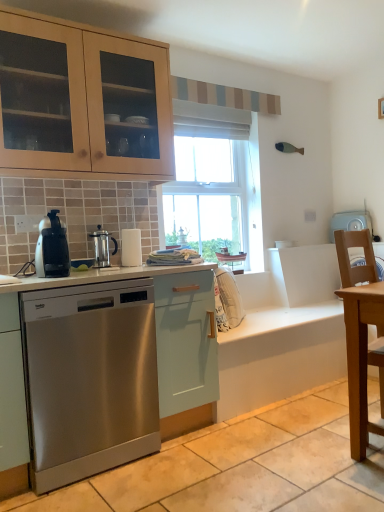
What do you see at coordinates (102, 247) in the screenshot? I see `satin silver coffee press at center` at bounding box center [102, 247].

Where is `light brown wooden table at right`? The height and width of the screenshot is (512, 384). light brown wooden table at right is located at coordinates (360, 358).

The height and width of the screenshot is (512, 384). Find the location of `satin silver coffee press at center`. satin silver coffee press at center is located at coordinates (102, 247).

Is stainless steel dishwasher at left spatially inside satin black coffee maker at left, or outside of it?

stainless steel dishwasher at left cannot be found inside satin black coffee maker at left.

Is stainless steel dishwasher at left wider or thinner than satin black coffee maker at left?

stainless steel dishwasher at left is wider than satin black coffee maker at left.

Is point (7, 296) farther from camera compared to point (55, 231)?

No, it is in front of (55, 231).

From the image's perspective, is stainless steel dishwasher at left below satin black coffee maker at left?

Correct, stainless steel dishwasher at left appears lower than satin black coffee maker at left in the image.

From the image's perspective, between satin black coffee maker at left and light blue plastic washing machine at right, who is located below?

satin black coffee maker at left is shown below in the image.

Would you say satin black coffee maker at left is inside or outside light blue plastic washing machine at right?

satin black coffee maker at left is located beyond the bounds of light blue plastic washing machine at right.

In the image, there is a light blue plastic washing machine at right. Identify the location of home appliance below it (from the image's perspective). The width and height of the screenshot is (384, 512). (52, 248).

Which of these two, satin black coffee maker at left or light blue plastic washing machine at right, stands taller?

Standing taller between the two is light blue plastic washing machine at right.

This screenshot has height=512, width=384. I want to click on home appliance in front of the satin silver coffee press at center, so click(52, 248).

Does satin silver coffee press at center have a larger size compared to satin black coffee maker at left?

No, satin silver coffee press at center is not bigger than satin black coffee maker at left.

Is satin silver coffee press at center positioned far away from satin black coffee maker at left?

No, satin silver coffee press at center is in close proximity to satin black coffee maker at left.

Does stainless steel dishwasher at left have a lesser width compared to satin silver coffee press at center?

No.

Is stainless steel dishwasher at left to the left or to the right of satin silver coffee press at center in the image?

Clearly, stainless steel dishwasher at left is on the left of satin silver coffee press at center in the image.

Find the location of `kitchen appliance that is above the stainless steel dishwasher at left (from a real-world perspective)`. kitchen appliance that is above the stainless steel dishwasher at left (from a real-world perspective) is located at coordinates (102, 247).

From the image's perspective, is stainless steel dishwasher at left located beneath satin silver coffee press at center?

Indeed, from the image's perspective, stainless steel dishwasher at left is shown beneath satin silver coffee press at center.

In terms of height, does light blue plastic washing machine at right look taller or shorter compared to stainless steel dishwasher at left?

Clearly, light blue plastic washing machine at right is shorter compared to stainless steel dishwasher at left.

Is point (353, 218) closer or farther from the camera than point (137, 268)?

Point (353, 218) is farther from the camera than point (137, 268).

Relative to stainless steel dishwasher at left, is light blue plastic washing machine at right in front or behind?

In the image, light blue plastic washing machine at right appears behind stainless steel dishwasher at left.

Is stainless steel dishwasher at left inside light blue plastic washing machine at right?

No.

Consider the image. What's the angular difference between light blue plastic washing machine at right and satin black coffee maker at left's facing directions?

There is a 88.8-degree angle between the facing directions of light blue plastic washing machine at right and satin black coffee maker at left.

Find the location of a particular element. The height and width of the screenshot is (512, 384). appliance positioned vertically above the satin black coffee maker at left (from a real-world perspective) is located at coordinates (350, 222).

Is light blue plastic washing machine at right touching satin black coffee maker at left?

No, light blue plastic washing machine at right is not making contact with satin black coffee maker at left.

Who is more distant, light blue plastic washing machine at right or satin black coffee maker at left?

light blue plastic washing machine at right is more distant.

Which is correct: light blue plastic washing machine at right is inside light brown wooden table at right, or outside of it?

The correct answer is: outside.

Between point (367, 216) and point (351, 455), which one is positioned in front?

Point (351, 455)

Image resolution: width=384 pixels, height=512 pixels. What are the coordinates of `table lying on the left of light blue plastic washing machine at right` in the screenshot? It's located at point(360,358).

Considering the sizes of objects light blue plastic washing machine at right and light brown wooden table at right in the image provided, who is thinner, light blue plastic washing machine at right or light brown wooden table at right?

With smaller width is light blue plastic washing machine at right.

Where is `cabinetry below the satin black coffee maker at left (from a real-world perspective)`? The image size is (384, 512). cabinetry below the satin black coffee maker at left (from a real-world perspective) is located at coordinates (184, 348).

In the image, there is a light blue plastic washing machine at right. Identify the location of home appliance below it (from the image's perspective). (52, 248).

From the picture: Looking at the image, which one is located further to satin black coffee maker at left, light blue plastic washing machine at right or stainless steel dishwasher at left?

light blue plastic washing machine at right is further to satin black coffee maker at left.

From the picture: From the image, which object appears to be farther from light blue plastic washing machine at right, stainless steel dishwasher at left or light brown wooden table at right?

Based on the image, stainless steel dishwasher at left appears to be further to light blue plastic washing machine at right.

Estimate the real-world distances between objects in this image. Which object is closer to light brown wooden table at right, light blue plastic washing machine at right or stainless steel dishwasher at left?

light blue plastic washing machine at right lies closer to light brown wooden table at right than the other object.

Considering their positions, is satin black coffee maker at left positioned closer to light brown wooden table at right than satin silver coffee press at center?

Among the two, satin silver coffee press at center is located nearer to light brown wooden table at right.

Looking at this image, from the image, which object appears to be nearer to satin silver coffee press at center, satin black coffee maker at left or light brown wooden table at right?

→ satin black coffee maker at left lies closer to satin silver coffee press at center than the other object.

From the picture: From the image, which object appears to be nearer to light blue plastic washing machine at right, stainless steel dishwasher at left or satin silver coffee press at center?

The object closer to light blue plastic washing machine at right is stainless steel dishwasher at left.

In the scene shown: From the image, which object appears to be nearer to light brown wooden table at right, stainless steel dishwasher at left or satin silver coffee press at center?

Among the two, stainless steel dishwasher at left is located nearer to light brown wooden table at right.

Estimate the real-world distances between objects in this image. Which object is further from satin black coffee maker at left, light brown wooden table at right or light blue plastic washing machine at right?

light blue plastic washing machine at right is further to satin black coffee maker at left.

I want to click on kitchen appliance between stainless steel dishwasher at left and light blue plastic washing machine at right, so click(x=102, y=247).

The image size is (384, 512). What are the coordinates of `table between satin black coffee maker at left and light blue plastic washing machine at right` in the screenshot? It's located at (360, 358).

I want to click on cabinetry located between satin black coffee maker at left and light blue plastic washing machine at right in the left-right direction, so click(184, 348).

This screenshot has height=512, width=384. I want to click on cabinetry between satin black coffee maker at left and light brown wooden table at right, so click(x=184, y=348).